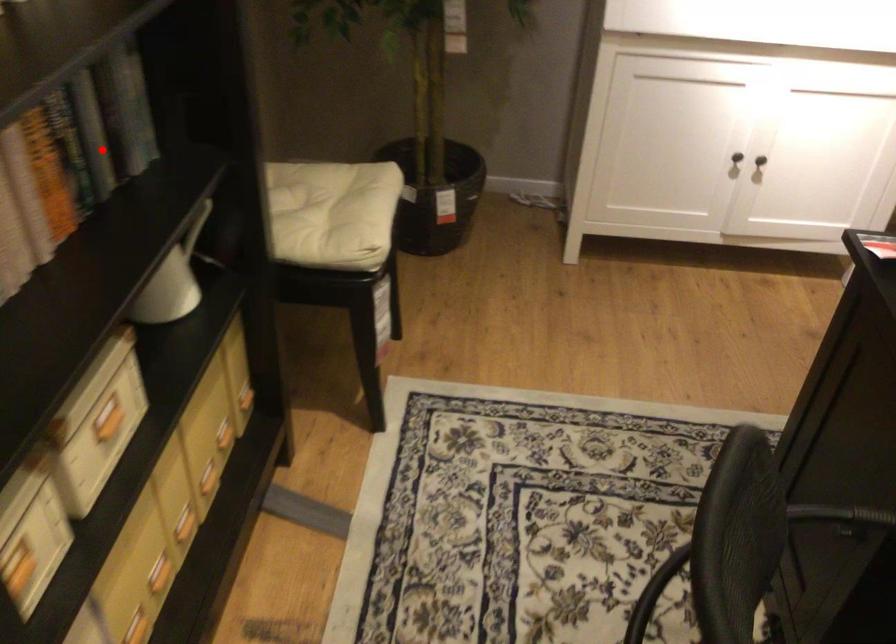
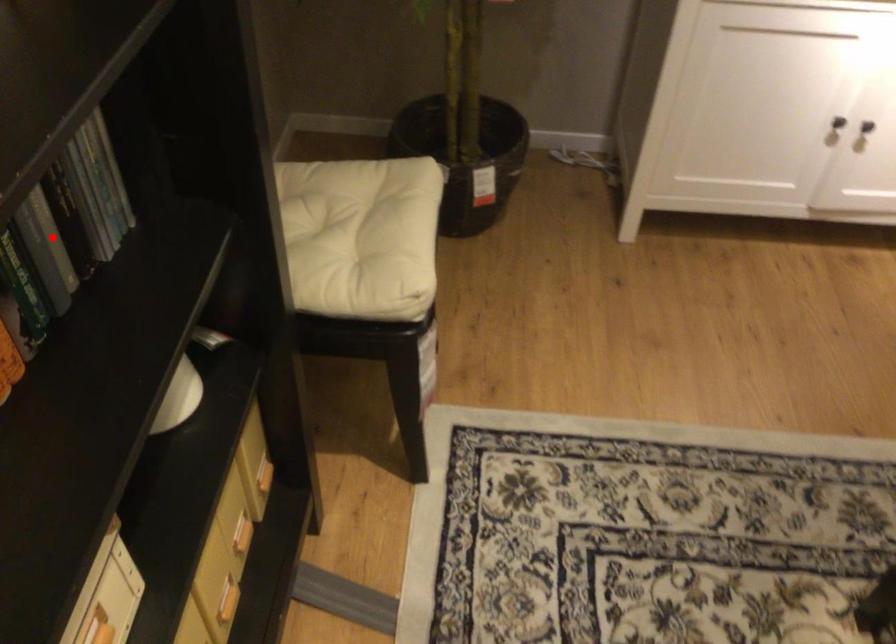
I am providing you with two images of the same scene from different viewpoints. A red point is marked on the first image and another point is marked on the second image. Do the highlighted points in image1 and image2 indicate the same real-world spot?

Yes